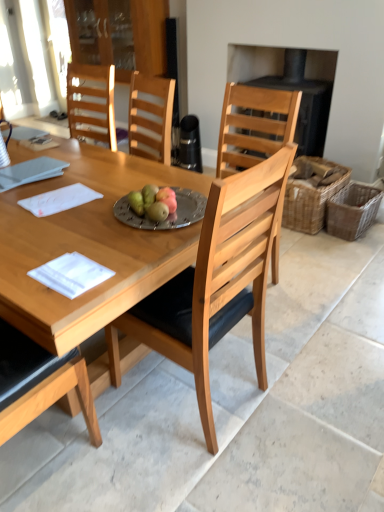
Question: From a real-world perspective, is transparent glass cabinet at upper center beneath wooden table at center?

Choices:
 (A) no
 (B) yes

Answer: (A)

Question: Can you confirm if transparent glass cabinet at upper center is positioned to the left of wooden table at center?

Choices:
 (A) yes
 (B) no

Answer: (B)

Question: Can you confirm if transparent glass cabinet at upper center is positioned to the right of wooden table at center?

Choices:
 (A) yes
 (B) no

Answer: (A)

Question: Is transparent glass cabinet at upper center not near wooden table at center?

Choices:
 (A) no
 (B) yes

Answer: (B)

Question: Can you confirm if transparent glass cabinet at upper center is bigger than wooden table at center?

Choices:
 (A) yes
 (B) no

Answer: (B)

Question: Is transparent glass cabinet at upper center wider than wooden table at center?

Choices:
 (A) yes
 (B) no

Answer: (B)

Question: From the image's perspective, is transparent glass cabinet at upper center over light wood chair at center?

Choices:
 (A) yes
 (B) no

Answer: (A)

Question: Is transparent glass cabinet at upper center facing towards light wood chair at center?

Choices:
 (A) no
 (B) yes

Answer: (A)

Question: Is the position of transparent glass cabinet at upper center less distant than that of light wood chair at center?

Choices:
 (A) no
 (B) yes

Answer: (A)

Question: Considering the relative sizes of transparent glass cabinet at upper center and light wood chair at center in the image provided, is transparent glass cabinet at upper center shorter than light wood chair at center?

Choices:
 (A) yes
 (B) no

Answer: (A)

Question: Considering the relative sizes of transparent glass cabinet at upper center and light wood chair at center in the image provided, is transparent glass cabinet at upper center smaller than light wood chair at center?

Choices:
 (A) no
 (B) yes

Answer: (A)

Question: Is transparent glass cabinet at upper center positioned with its back to light wood chair at center?

Choices:
 (A) yes
 (B) no

Answer: (B)

Question: Would you consider white paper at center, the 1th notepad when ordered from bottom to top, to be distant from woven brown picnic basket at right, which is the second picnic basket in left-to-right order?

Choices:
 (A) no
 (B) yes

Answer: (B)